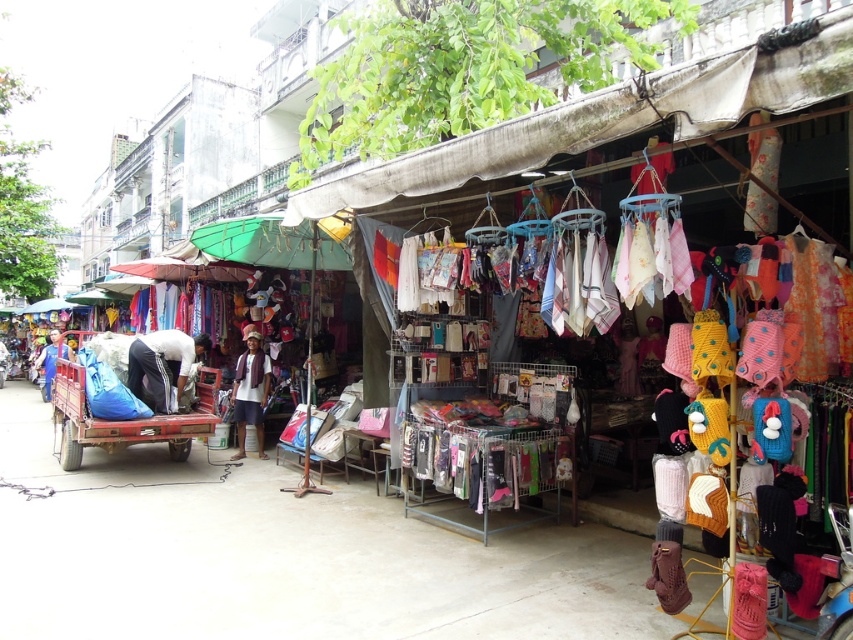
Question: Is matte red cart at lower left positioned before white cotton shirt at center?

Choices:
 (A) no
 (B) yes

Answer: (B)

Question: Is dark blue pants at left positioned before white fabric bag at left?

Choices:
 (A) yes
 (B) no

Answer: (A)

Question: Is white cotton shirt at center closer to camera compared to blue fabric at left?

Choices:
 (A) yes
 (B) no

Answer: (A)

Question: Among these objects, which one is nearest to the camera?

Choices:
 (A) white fabric bag at left
 (B) dark blue pants at left
 (C) white cotton shirt at center
 (D) matte red cart at lower left

Answer: (D)

Question: Which object is the farthest from the dark blue pants at left?

Choices:
 (A) white cotton shirt at center
 (B) blue fabric at left
 (C) white fabric bag at left

Answer: (C)

Question: Which point is closer to the camera?

Choices:
 (A) (47, 396)
 (B) (241, 456)
 (C) (135, 371)
 (D) (74, 458)

Answer: (C)